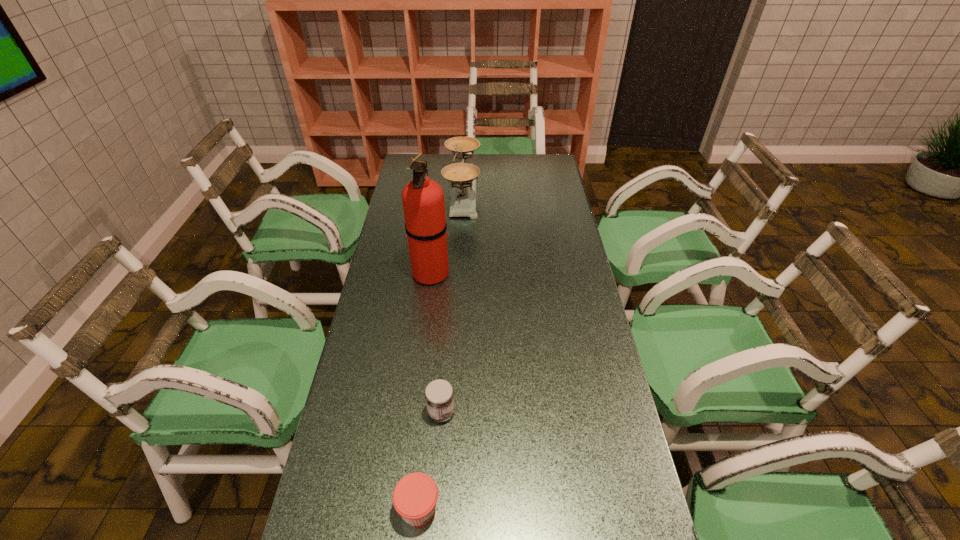
Identify the location of free space between the taller jam and the scale. The width and height of the screenshot is (960, 540). (x=452, y=303).

Where is `free space between the third tallest object and the nearest object`? The height and width of the screenshot is (540, 960). free space between the third tallest object and the nearest object is located at coordinates (430, 460).

This screenshot has width=960, height=540. Identify the location of empty location between the shortest object and the tallest object. (424, 390).

At what (x,y) coordinates should I click in order to perform the action: click on object that stands as the second closest to the second nearest object. Please return your answer as a coordinate pair (x, y). The image size is (960, 540). Looking at the image, I should click on (423, 201).

Find the location of a particular element. The height and width of the screenshot is (540, 960). object that is the nearest to the fire extinguisher is located at coordinates (462, 176).